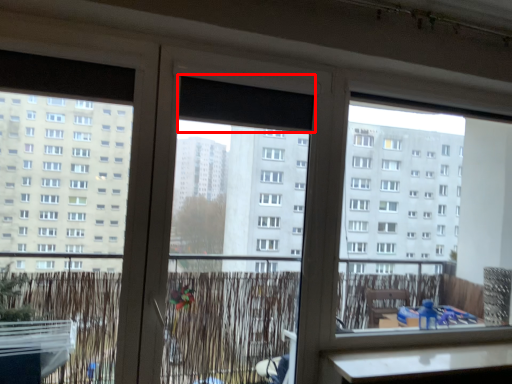
Question: From the image's perspective, where is window screen (annotated by the red box) located relative to screen door?

Choices:
 (A) below
 (B) above

Answer: (B)